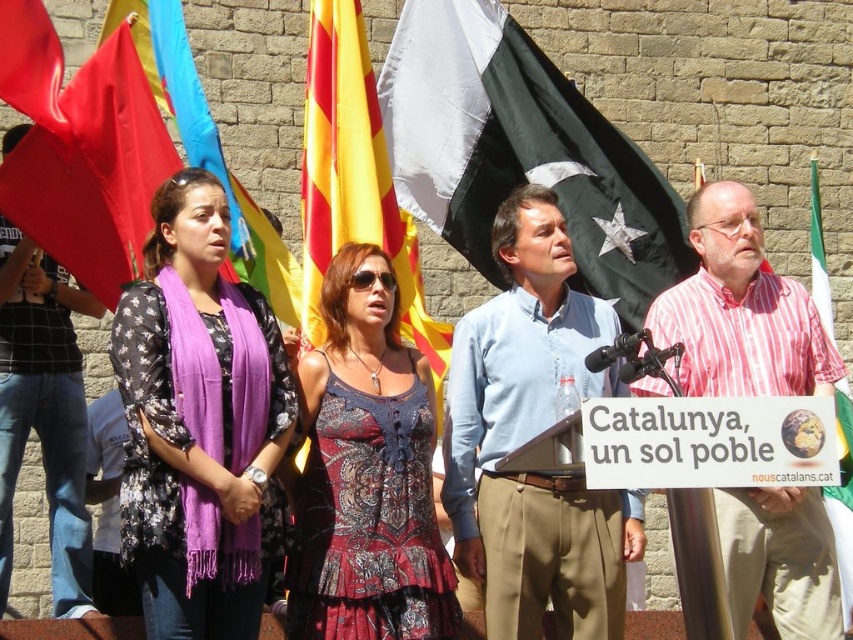
You are a photographer at the demonstration. You want to capture a photo where both the purple scarf at center and the red fabric flag at upper left are clearly visible. Which object should you focus on to ensure both are in the frame?

The purple scarf at center is in front of the red fabric flag at upper left, so focusing on the purple scarf at center will ensure both are visible in the frame.

You are a photographer standing at the front of the demonstration scene. You want to take a photo that includes both the point at coordinate point (225, 506) and point (138, 16). Which point should you focus on first to ensure both are in focus?

You should focus on point (225, 506) first because it is closer to the camera than point (138, 16), ensuring both will be in focus when focusing on the closer one.